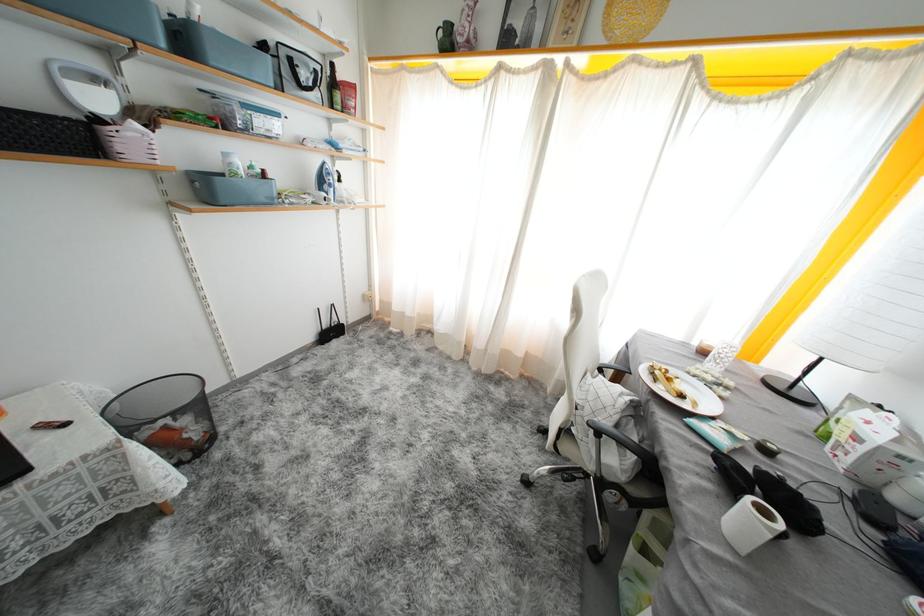
Locate an element on the screen. This screenshot has height=616, width=924. chair sitting surface is located at coordinates click(x=604, y=419).